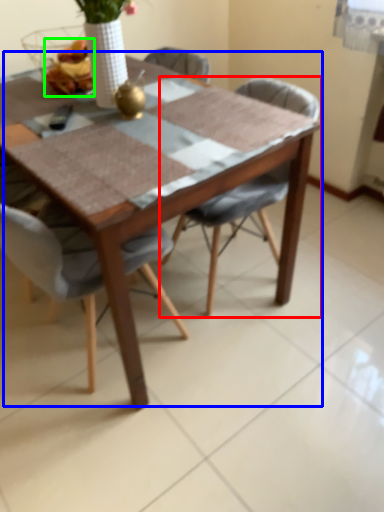
Question: Considering the real-world distances, which object is farthest from chair (highlighted by a red box)? table (highlighted by a blue box) or food (highlighted by a green box)?

Choices:
 (A) table
 (B) food

Answer: (B)